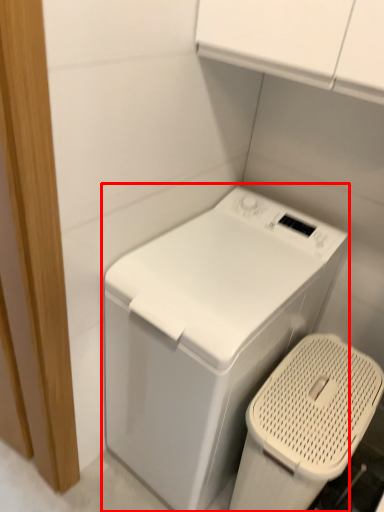
Question: Observing the image, what is the correct spatial positioning of washing machine (annotated by the red box) in reference to appliance?

Choices:
 (A) left
 (B) right

Answer: (A)